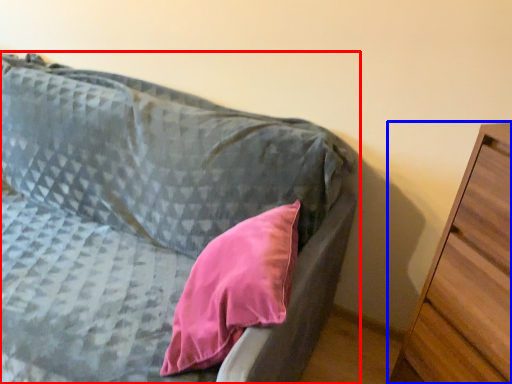
Question: Among these objects, which one is nearest to the camera, furniture (highlighted by a red box) or chest of drawers (highlighted by a blue box)?

Choices:
 (A) furniture
 (B) chest of drawers

Answer: (A)